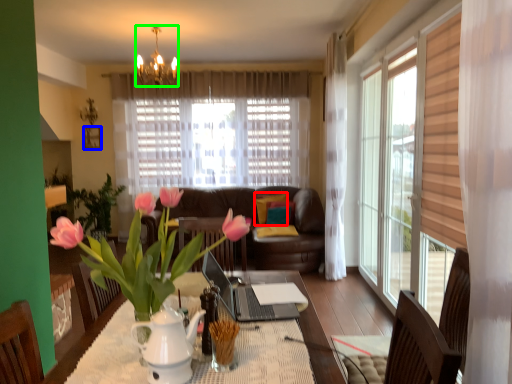
Question: Estimate the real-world distances between objects in this image. Which object is farther from pillow (highlighted by a red box), picture frame (highlighted by a blue box) or lamp (highlighted by a green box)?

Choices:
 (A) picture frame
 (B) lamp

Answer: (A)